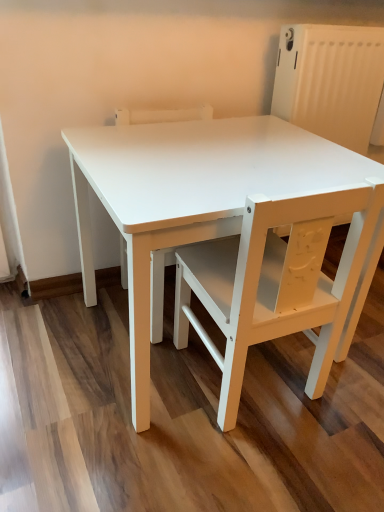
What do you see at coordinates (158, 290) in the screenshot? I see `white matte chair at center, which is counted as the 2th chair, starting from the right` at bounding box center [158, 290].

I want to click on white matte chair at center, arranged as the 1th chair when viewed from the left, so click(x=158, y=290).

Where is `white matte chair at center, the 2th chair positioned from the left`? Image resolution: width=384 pixels, height=512 pixels. white matte chair at center, the 2th chair positioned from the left is located at coordinates (280, 284).

What is the approximate height of white matte chair at center, the 2th chair positioned from the left?

It is 20.77 inches.

This screenshot has height=512, width=384. What do you see at coordinates (280, 284) in the screenshot?
I see `white matte chair at center, positioned as the first chair in right-to-left order` at bounding box center [280, 284].

The width and height of the screenshot is (384, 512). I want to click on white matte chair at center, which is counted as the 2th chair, starting from the right, so click(158, 290).

Does white matte chair at center, which is counted as the 2th chair, starting from the right, appear on the right side of white matte chair at center, positioned as the first chair in right-to-left order?

Incorrect, white matte chair at center, which is counted as the 2th chair, starting from the right, is not on the right side of white matte chair at center, positioned as the first chair in right-to-left order.

Does white matte chair at center, which is counted as the 2th chair, starting from the right, lie behind white matte chair at center, the 2th chair positioned from the left?

Yes, white matte chair at center, which is counted as the 2th chair, starting from the right, is further from the camera.

Considering the points (155, 298) and (226, 359), which point is behind, point (155, 298) or point (226, 359)?

The point (155, 298) is farther from the camera.

From the image's perspective, is white matte chair at center, which is counted as the 2th chair, starting from the right, above or below white matte chair at center, positioned as the first chair in right-to-left order?

white matte chair at center, which is counted as the 2th chair, starting from the right, is above white matte chair at center, positioned as the first chair in right-to-left order.

Consider the image. From a real-world perspective, is white matte chair at center, arranged as the 1th chair when viewed from the left, physically above white matte chair at center, positioned as the first chair in right-to-left order?

No, from a real-world perspective, white matte chair at center, arranged as the 1th chair when viewed from the left, is not above white matte chair at center, positioned as the first chair in right-to-left order.

Can you confirm if white matte chair at center, arranged as the 1th chair when viewed from the left, is wider than white matte chair at center, the 2th chair positioned from the left?

No.

From the picture: Between white matte chair at center, arranged as the 1th chair when viewed from the left, and white matte chair at center, the 2th chair positioned from the left, which one has more height?

With more height is white matte chair at center, arranged as the 1th chair when viewed from the left.

Which of these two, white matte chair at center, arranged as the 1th chair when viewed from the left, or white matte chair at center, positioned as the first chair in right-to-left order, is smaller?

With smaller size is white matte chair at center, positioned as the first chair in right-to-left order.

Can we say white matte chair at center, which is counted as the 2th chair, starting from the right, lies outside white matte chair at center, positioned as the first chair in right-to-left order?

white matte chair at center, which is counted as the 2th chair, starting from the right, lies outside white matte chair at center, positioned as the first chair in right-to-left order,'s area.

Is white matte chair at center, which is counted as the 2th chair, starting from the right, not near white matte chair at center, positioned as the first chair in right-to-left order?

white matte chair at center, which is counted as the 2th chair, starting from the right, is actually quite close to white matte chair at center, positioned as the first chair in right-to-left order.

Does white matte chair at center, which is counted as the 2th chair, starting from the right, turn towards white matte chair at center, positioned as the first chair in right-to-left order?

Yes, white matte chair at center, which is counted as the 2th chair, starting from the right, is turned towards white matte chair at center, positioned as the first chair in right-to-left order.

How many degrees apart are the facing directions of white matte chair at center, which is counted as the 2th chair, starting from the right, and white matte chair at center, positioned as the first chair in right-to-left order?

180 degrees separate the facing orientations of white matte chair at center, which is counted as the 2th chair, starting from the right, and white matte chair at center, positioned as the first chair in right-to-left order.

How far apart are white matte chair at center, arranged as the 1th chair when viewed from the left, and white matte chair at center, positioned as the first chair in right-to-left order?

white matte chair at center, arranged as the 1th chair when viewed from the left, is 9.69 inches from white matte chair at center, positioned as the first chair in right-to-left order.

Identify the location of chair lying on the left of white matte chair at center, positioned as the first chair in right-to-left order. (158, 290).

Which object is positioned more to the right, white matte chair at center, positioned as the first chair in right-to-left order, or white matte chair at center, arranged as the 1th chair when viewed from the left?

Positioned to the right is white matte chair at center, positioned as the first chair in right-to-left order.

In the image, is white matte chair at center, positioned as the first chair in right-to-left order, positioned in front of or behind white matte chair at center, which is counted as the 2th chair, starting from the right?

Clearly, white matte chair at center, positioned as the first chair in right-to-left order, is in front of white matte chair at center, which is counted as the 2th chair, starting from the right.

Does point (254, 209) come closer to viewer compared to point (163, 264)?

Yes, point (254, 209) is closer to viewer.

From the image's perspective, is white matte chair at center, positioned as the first chair in right-to-left order, located beneath white matte chair at center, which is counted as the 2th chair, starting from the right?

Correct, white matte chair at center, positioned as the first chair in right-to-left order, appears lower than white matte chair at center, which is counted as the 2th chair, starting from the right, in the image.

From a real-world perspective, which object stands above the other?

white matte chair at center, positioned as the first chair in right-to-left order, is physically above.

Looking at their sizes, would you say white matte chair at center, the 2th chair positioned from the left, is wider or thinner than white matte chair at center, which is counted as the 2th chair, starting from the right?

Clearly, white matte chair at center, the 2th chair positioned from the left, has more width compared to white matte chair at center, which is counted as the 2th chair, starting from the right.

Based on the photo, is white matte chair at center, the 2th chair positioned from the left, taller than white matte chair at center, which is counted as the 2th chair, starting from the right?

No, white matte chair at center, the 2th chair positioned from the left, is not taller than white matte chair at center, which is counted as the 2th chair, starting from the right.

Is white matte chair at center, positioned as the first chair in right-to-left order, bigger than white matte chair at center, which is counted as the 2th chair, starting from the right?

Incorrect, white matte chair at center, positioned as the first chair in right-to-left order, is not larger than white matte chair at center, which is counted as the 2th chair, starting from the right.

Would you say white matte chair at center, positioned as the first chair in right-to-left order, is inside or outside white matte chair at center, which is counted as the 2th chair, starting from the right?

white matte chair at center, positioned as the first chair in right-to-left order, is outside white matte chair at center, which is counted as the 2th chair, starting from the right.

Is white matte chair at center, the 2th chair positioned from the left, far away from white matte chair at center, arranged as the 1th chair when viewed from the left?

They are positioned close to each other.

Is white matte chair at center, the 2th chair positioned from the left, looking in the opposite direction of white matte chair at center, which is counted as the 2th chair, starting from the right?

white matte chair at center, the 2th chair positioned from the left, does not have its back to white matte chair at center, which is counted as the 2th chair, starting from the right.

Where is `chair on the left of the white matte chair at center, the 2th chair positioned from the left`? Image resolution: width=384 pixels, height=512 pixels. chair on the left of the white matte chair at center, the 2th chair positioned from the left is located at coordinates 158,290.

You are a GUI agent. You are given a task and a screenshot of the screen. Output one action in this format:
    pyautogui.click(x=<x>, y=<y>)
    Task: Click on the chair below the white matte chair at center, the 2th chair positioned from the left (from a real-world perspective)
    
    Given the screenshot: What is the action you would take?
    pyautogui.click(x=158, y=290)

Find the location of a particular element. Image resolution: width=384 pixels, height=512 pixels. chair behind the white matte chair at center, positioned as the first chair in right-to-left order is located at coordinates (158, 290).